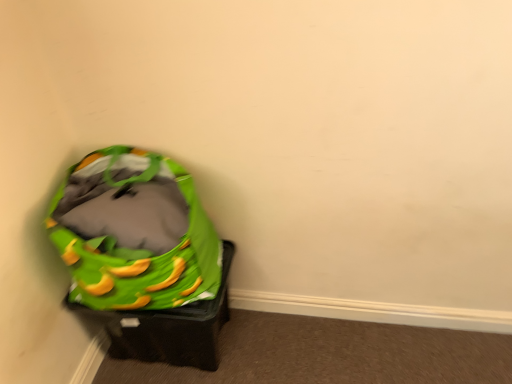
Locate an element on the screen. The height and width of the screenshot is (384, 512). free location to the right of green fabric bag at lower left is located at coordinates (283, 347).